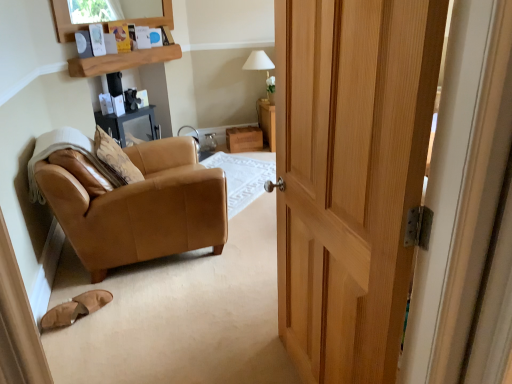
Question: From the image's perspective, does tan suede slippers at lower left appear higher than white fabric lampshade at upper center?

Choices:
 (A) no
 (B) yes

Answer: (A)

Question: Can you confirm if tan suede slippers at lower left is smaller than white fabric lampshade at upper center?

Choices:
 (A) yes
 (B) no

Answer: (A)

Question: Is tan suede slippers at lower left oriented towards white fabric lampshade at upper center?

Choices:
 (A) no
 (B) yes

Answer: (A)

Question: Is tan suede slippers at lower left shorter than white fabric lampshade at upper center?

Choices:
 (A) yes
 (B) no

Answer: (A)

Question: Does tan suede slippers at lower left lie in front of white fabric lampshade at upper center?

Choices:
 (A) no
 (B) yes

Answer: (B)

Question: Based on their positions, is tan suede slippers at lower left located to the left or right of tan leather chair at left?

Choices:
 (A) right
 (B) left

Answer: (B)

Question: Looking at their shapes, would you say tan suede slippers at lower left is wider or thinner than tan leather chair at left?

Choices:
 (A) wide
 (B) thin

Answer: (B)

Question: Which is correct: tan suede slippers at lower left is inside tan leather chair at left, or outside of it?

Choices:
 (A) outside
 (B) inside

Answer: (A)

Question: From the image's perspective, is tan suede slippers at lower left located above or below tan leather chair at left?

Choices:
 (A) below
 (B) above

Answer: (A)

Question: From a real-world perspective, is wooden shelf at upper center positioned above or below wooden drawer at center?

Choices:
 (A) below
 (B) above

Answer: (B)

Question: In terms of width, does wooden shelf at upper center look wider or thinner when compared to wooden drawer at center?

Choices:
 (A) thin
 (B) wide

Answer: (A)

Question: Considering the relative positions of wooden shelf at upper center and wooden drawer at center in the image provided, is wooden shelf at upper center to the left or to the right of wooden drawer at center?

Choices:
 (A) right
 (B) left

Answer: (B)

Question: Is wooden shelf at upper center taller or shorter than wooden drawer at center?

Choices:
 (A) tall
 (B) short

Answer: (B)

Question: Is point (260, 135) positioned closer to the camera than point (74, 66)?

Choices:
 (A) closer
 (B) farther

Answer: (B)

Question: Is wooden drawer at center to the left or to the right of wooden shelf at upper center in the image?

Choices:
 (A) left
 (B) right

Answer: (B)